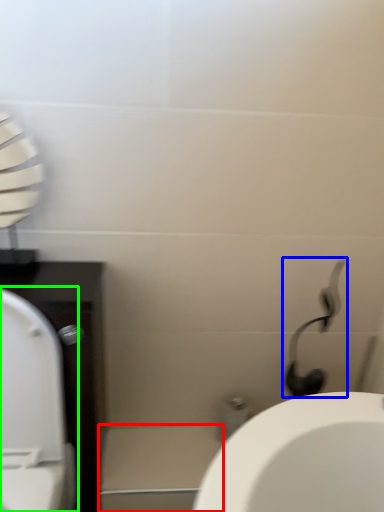
Question: Considering the real-world distances, which object is closest to porcelain (highlighted by a red box)? shower (highlighted by a blue box) or toilet (highlighted by a green box).

Choices:
 (A) shower
 (B) toilet

Answer: (B)